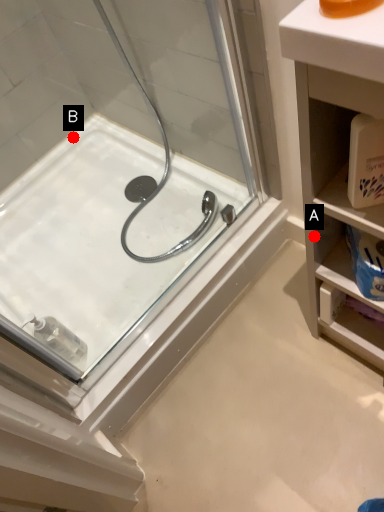
Question: Two points are circled on the image, labeled by A and B beside each circle. Which point is closer to the camera taking this photo?

Choices:
 (A) A is closer
 (B) B is closer

Answer: (A)